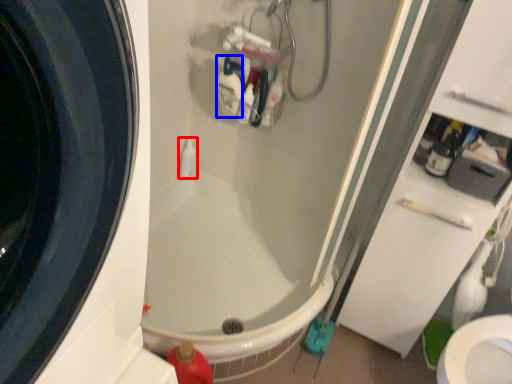
Question: Which object appears farthest to the camera in this image, toiletry (highlighted by a red box) or cleaning product (highlighted by a blue box)?

Choices:
 (A) toiletry
 (B) cleaning product

Answer: (A)